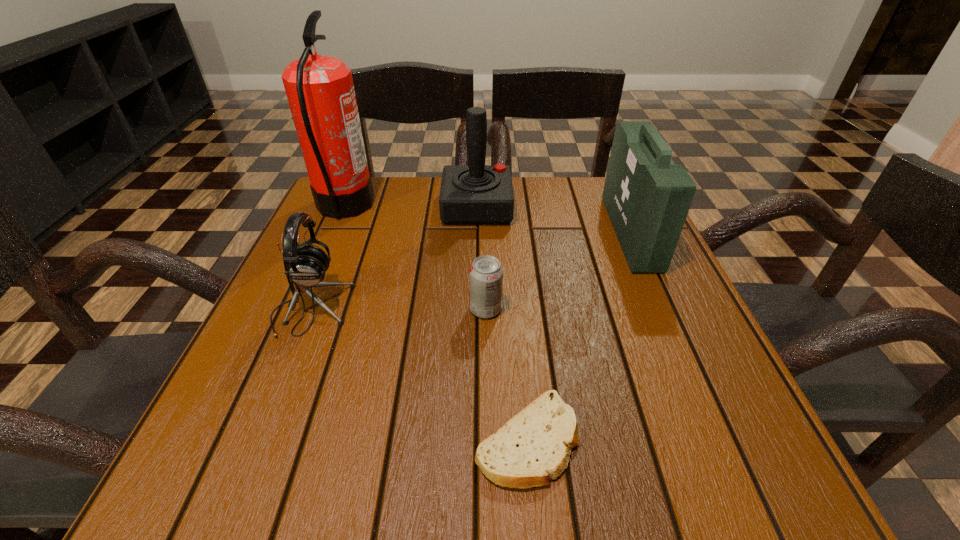
Where is `the tallest object`? Image resolution: width=960 pixels, height=540 pixels. the tallest object is located at coordinates (320, 91).

Identify the location of joystick. Image resolution: width=960 pixels, height=540 pixels. (475, 194).

Identify the location of the rightmost object. coord(647,197).

This screenshot has height=540, width=960. In order to click on earphone in this screenshot , I will do `click(306, 264)`.

The height and width of the screenshot is (540, 960). What are the coordinates of `the fifth tallest object` in the screenshot? It's located at (486, 273).

Locate an element on the screen. The width and height of the screenshot is (960, 540). the nearest object is located at coordinates (534, 446).

Find the location of a particular element. The width and height of the screenshot is (960, 540). pita bread is located at coordinates (534, 446).

You are a GUI agent. You are given a task and a screenshot of the screen. Output one action in this format:
    pyautogui.click(x=<x>, y=<y>)
    Task: Click on the free space located on the front side of the tallest object
    The width and height of the screenshot is (960, 540).
    Given the screenshot: What is the action you would take?
    pyautogui.click(x=502, y=207)

Locate an element on the screen. vacant point located 0.070m on the base of the joystick is located at coordinates (539, 208).

In order to click on free location located on the front-facing side of the rightmost object in this screenshot , I will do point(556,233).